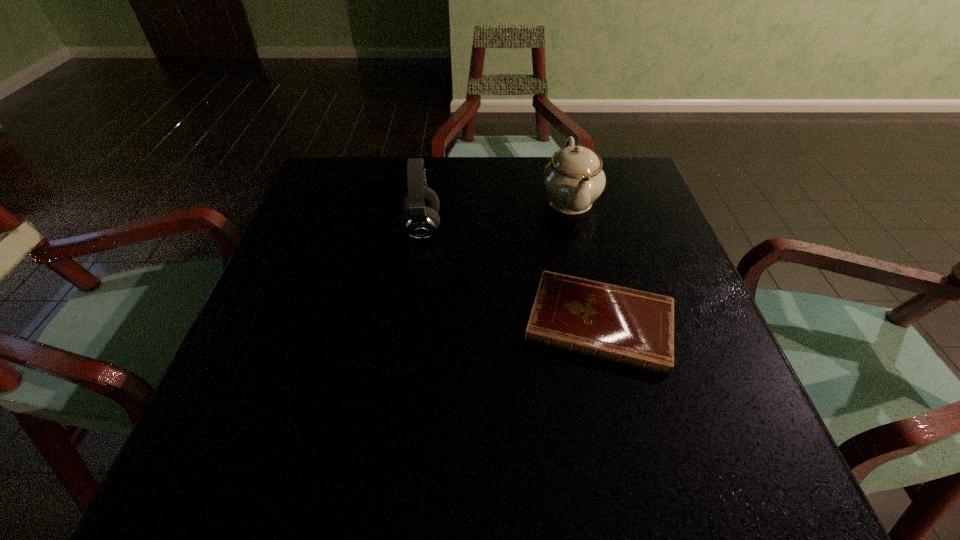
Where is `empty space between the chinaware and the leftmost object`? empty space between the chinaware and the leftmost object is located at coordinates (496, 214).

Where is `empty space between the chinaware and the notebook`? This screenshot has height=540, width=960. empty space between the chinaware and the notebook is located at coordinates (585, 261).

Where is `vacant space that's between the chinaware and the headset`? vacant space that's between the chinaware and the headset is located at coordinates (496, 214).

Image resolution: width=960 pixels, height=540 pixels. I want to click on empty space that is in between the chinaware and the headset, so click(x=496, y=214).

Find the location of a particular element. The image size is (960, 540). free space between the chinaware and the notebook is located at coordinates (585, 261).

You are a GUI agent. You are given a task and a screenshot of the screen. Output one action in this format:
    pyautogui.click(x=<x>, y=<y>)
    Task: Click on the vacant space that's between the chinaware and the nearest object
    
    Given the screenshot: What is the action you would take?
    pyautogui.click(x=585, y=261)

The width and height of the screenshot is (960, 540). In order to click on vacant space that's between the shortest object and the chinaware in this screenshot , I will do [585, 261].

At what (x,y) coordinates should I click in order to perform the action: click on free spot between the leftmost object and the shortest object. Please return your answer as a coordinate pair (x, y). This screenshot has height=540, width=960. Looking at the image, I should click on (511, 275).

This screenshot has height=540, width=960. In order to click on blank region between the nearest object and the chinaware in this screenshot , I will do `click(585, 261)`.

You are a GUI agent. You are given a task and a screenshot of the screen. Output one action in this format:
    pyautogui.click(x=<x>, y=<y>)
    Task: Click on the object that is the closest to the chinaware
    
    Given the screenshot: What is the action you would take?
    pyautogui.click(x=633, y=327)